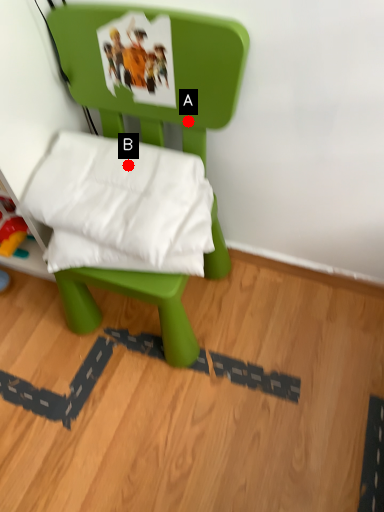
Question: Two points are circled on the image, labeled by A and B beside each circle. Which point appears farthest from the camera in this image?

Choices:
 (A) A is further
 (B) B is further

Answer: (B)